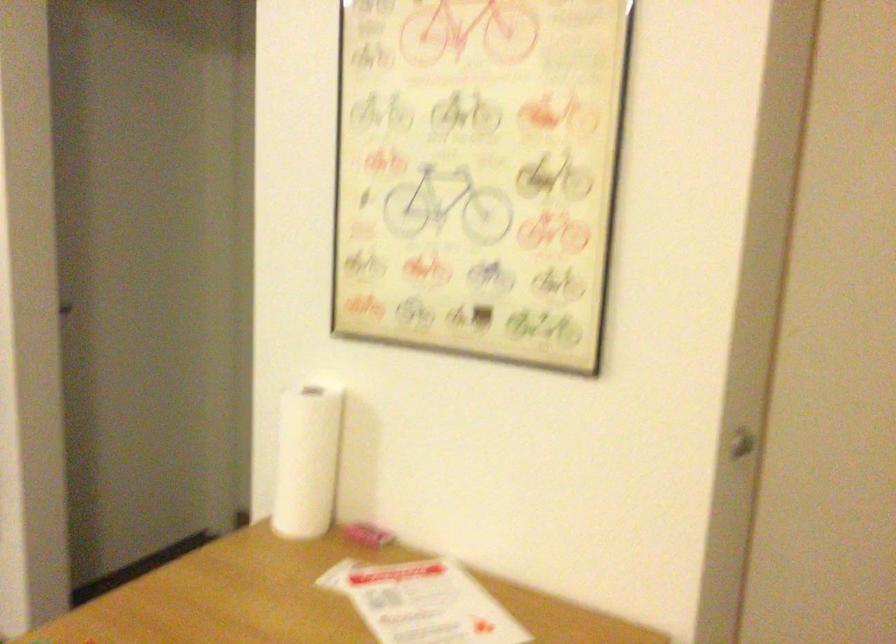
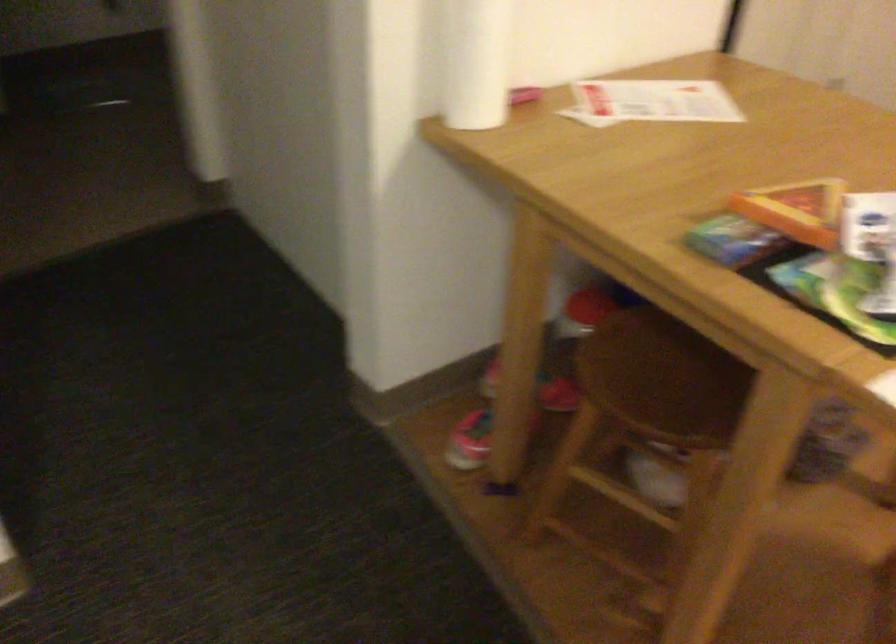
Locate, in the second image, the point that corresponds to point 303,476 in the first image.

(476, 62)